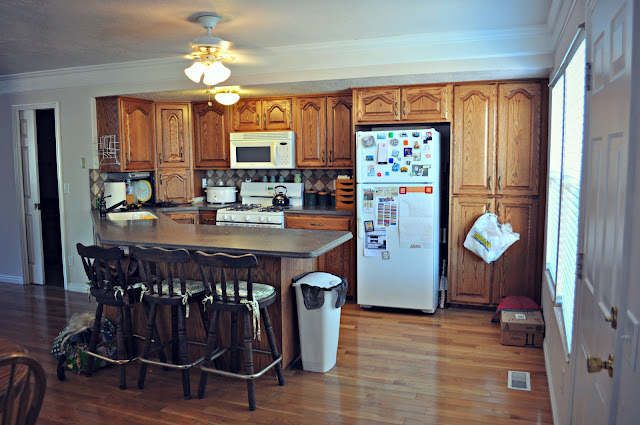
This screenshot has height=425, width=640. Identify the location of door knob. (596, 365).